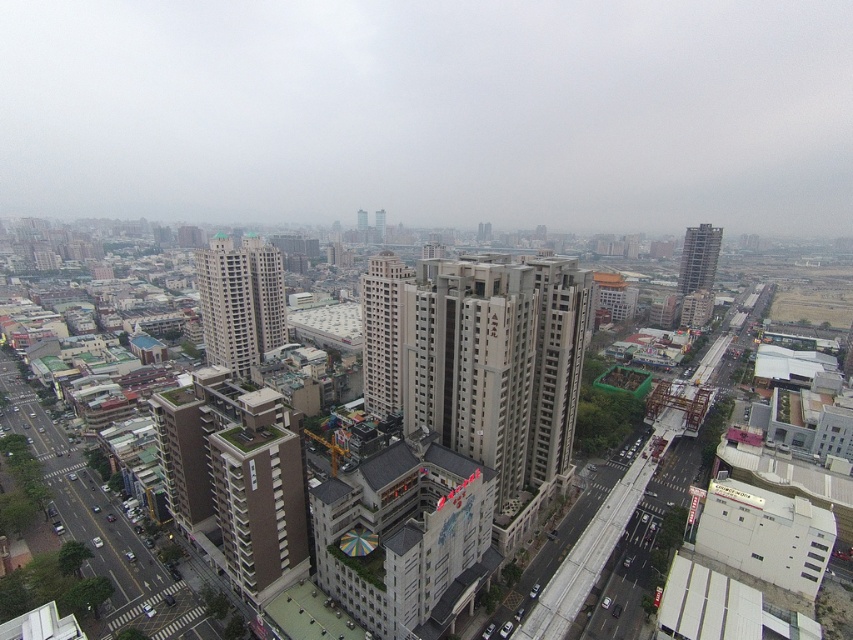
You are a drone operator trying to navigate between two buildings in the urban area. You need to fly from the beige concrete building at center to the gray concrete building at upper right. In which direction should you steer the drone to reach the destination?

The beige concrete building at center is to the left of gray concrete building at upper right, so you should steer the drone to the right to reach the gray concrete building at upper right from the beige concrete building at center.

You are standing at the point with coordinates point (369, 348) and want to move towards point (279, 259). Given that you can only move in straight lines and the area between them is clear of obstacles, will you have to walk uphill or downhill?

Since point (279, 259) is further to the camera than point (369, 348), this implies that point (279, 259) is closer to the observer. In an aerial view, being closer to the camera typically corresponds to a higher elevation in the actual terrain. Therefore, moving from point (369, 348) to point (279, 259) would involve walking uphill.